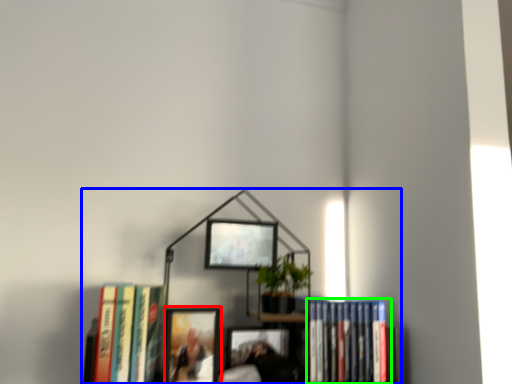
Question: Based on their relative distances, which object is farther from picture frame (highlighted by a red box)? Choose from bookcase (highlighted by a blue box) and book (highlighted by a green box).

Choices:
 (A) bookcase
 (B) book

Answer: (B)